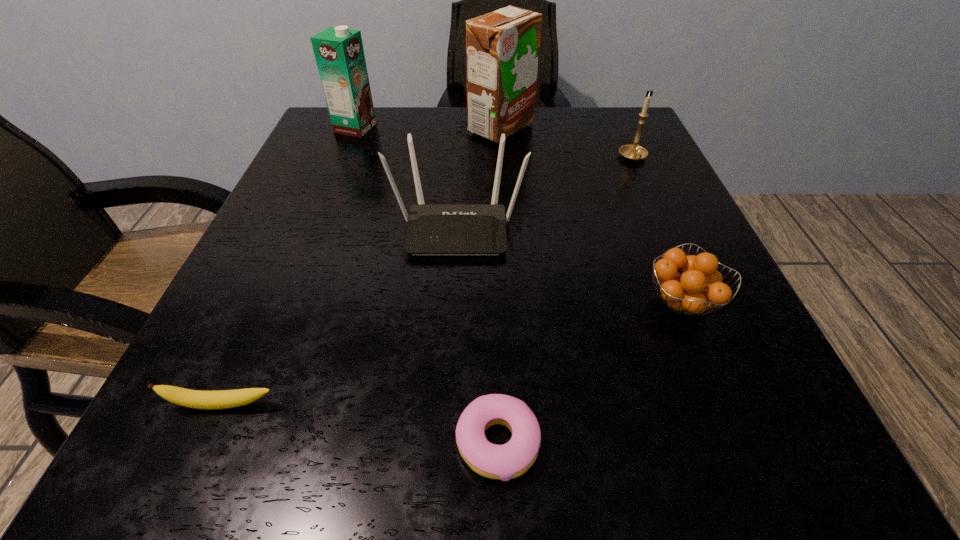
Find the location of a particular element. This screenshot has height=540, width=960. free area in between the fourth farthest object and the orange fruit is located at coordinates (569, 265).

This screenshot has width=960, height=540. Find the location of `vacant area between the third shortest object and the router`. vacant area between the third shortest object and the router is located at coordinates (569, 265).

I want to click on object that is the fourth closest to the right carton, so click(699, 288).

Locate which object ranks in proximity to the sixth tallest object. Please provide its 2D coordinates. Your answer should be formatted as a tuple, i.e. [(x, y)], where the tuple contains the x and y coordinates of a point satisfying the conditions above.

[(504, 462)]